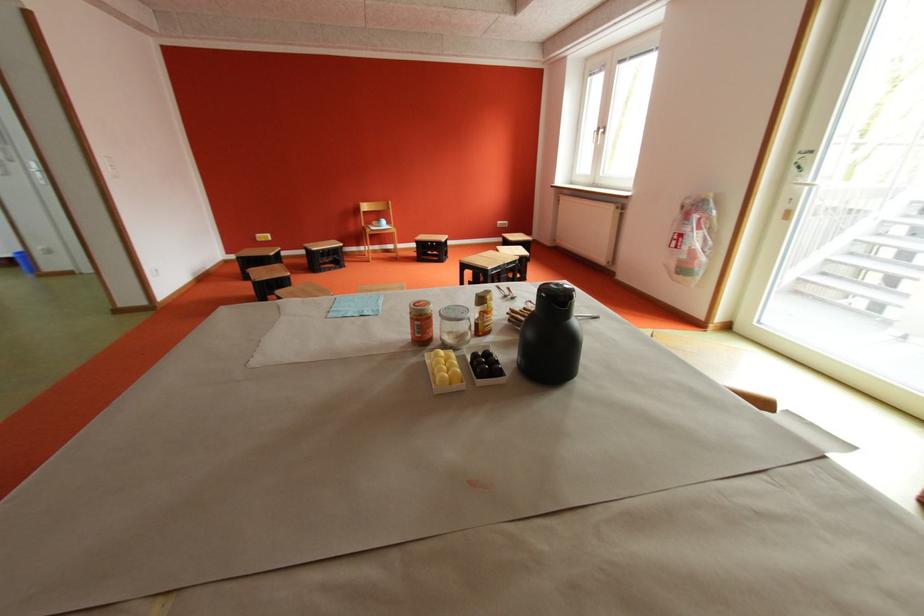
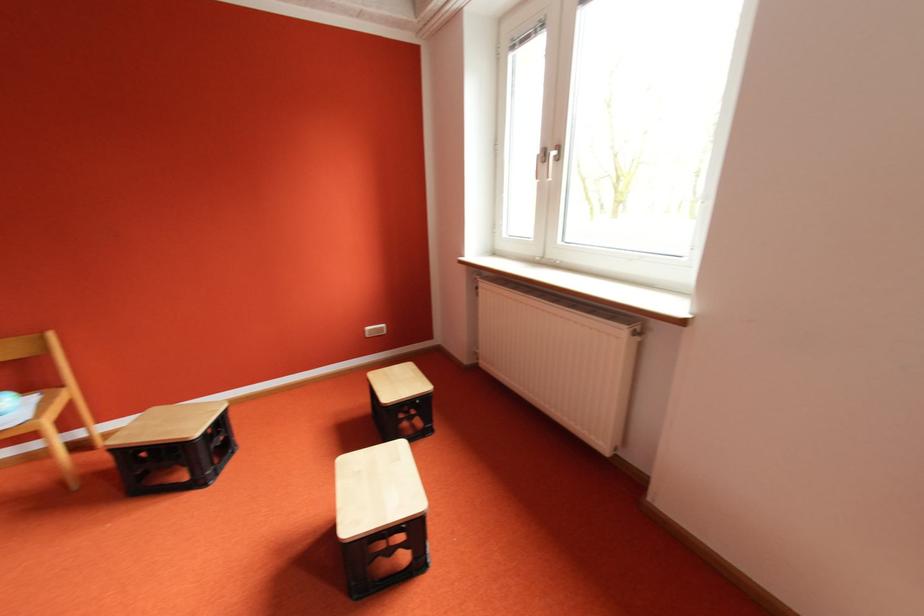
Question: Which direction would the cameraman need to move to produce the second image? Reply with the corresponding letter.

Choices:
 (A) Left
 (B) Right
 (C) Forward
 (D) Backward

Answer: (C)